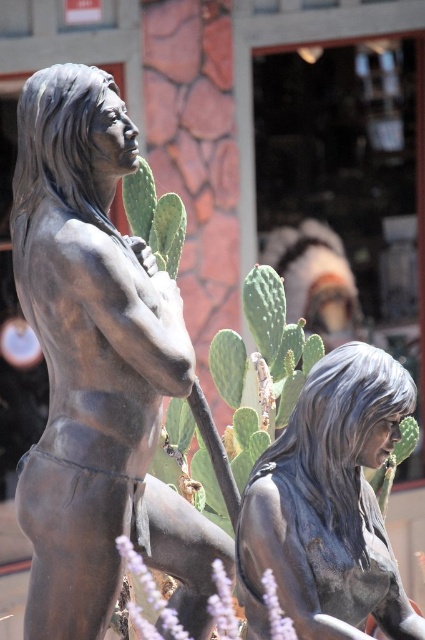
Question: Can you confirm if bronze statue at left is wider than shiny bronze statue at center?

Choices:
 (A) yes
 (B) no

Answer: (A)

Question: Can you confirm if bronze statue at left is positioned to the left of shiny bronze statue at center?

Choices:
 (A) yes
 (B) no

Answer: (A)

Question: Among these points, which one is farthest from the camera?

Choices:
 (A) (90, 381)
 (B) (329, 444)

Answer: (A)

Question: Which object is closer to the camera taking this photo?

Choices:
 (A) shiny bronze statue at center
 (B) bronze statue at left

Answer: (A)

Question: Can you confirm if bronze statue at left is smaller than shiny bronze statue at center?

Choices:
 (A) no
 (B) yes

Answer: (A)